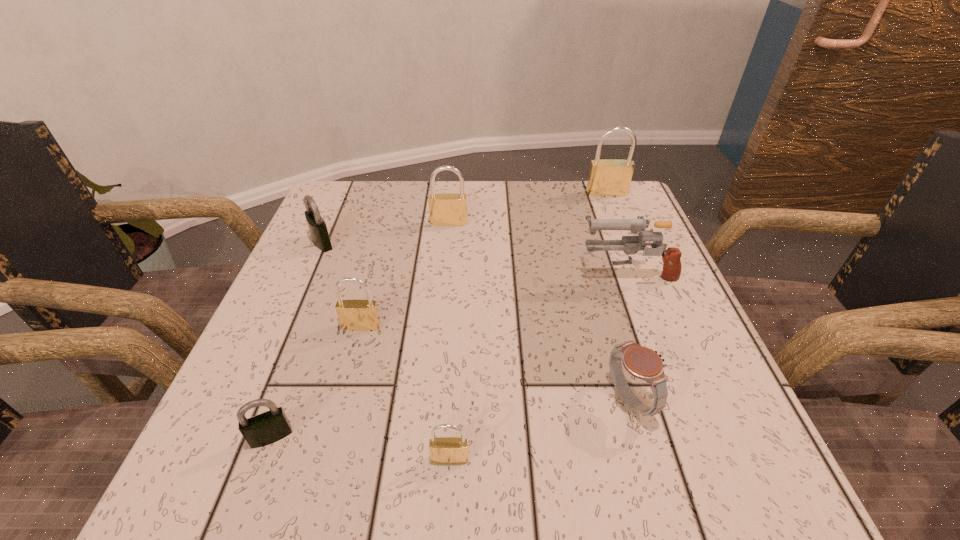
Where is `free location at the near edge of the desktop`? The width and height of the screenshot is (960, 540). free location at the near edge of the desktop is located at coordinates (317, 444).

In the image, there is a desktop. Where is `blank space at the right edge`? The width and height of the screenshot is (960, 540). blank space at the right edge is located at coordinates (670, 361).

Where is `vacant space at the far left corner of the desktop`? The image size is (960, 540). vacant space at the far left corner of the desktop is located at coordinates (372, 189).

Where is `free space at the near left corner`? The height and width of the screenshot is (540, 960). free space at the near left corner is located at coordinates (211, 455).

The width and height of the screenshot is (960, 540). I want to click on free spot between the fifth nearest object and the gray watch, so click(x=628, y=336).

At what (x,y) coordinates should I click in order to perform the action: click on free space between the watch and the fifth nearest object. Please return your answer as a coordinate pair (x, y). This screenshot has width=960, height=540. Looking at the image, I should click on (628, 336).

I want to click on vacant area that lies between the watch and the second nearest brass padlock, so click(495, 363).

This screenshot has width=960, height=540. I want to click on vacant space that's between the smaller black padlock and the farthest object, so click(439, 315).

Where is `vacant space that's between the third farthest brass padlock and the third farthest object`? This screenshot has height=540, width=960. vacant space that's between the third farthest brass padlock and the third farthest object is located at coordinates (342, 285).

Find the location of a particular element. This screenshot has width=960, height=540. free space that is in between the nearest padlock and the second nearest brass padlock is located at coordinates (406, 393).